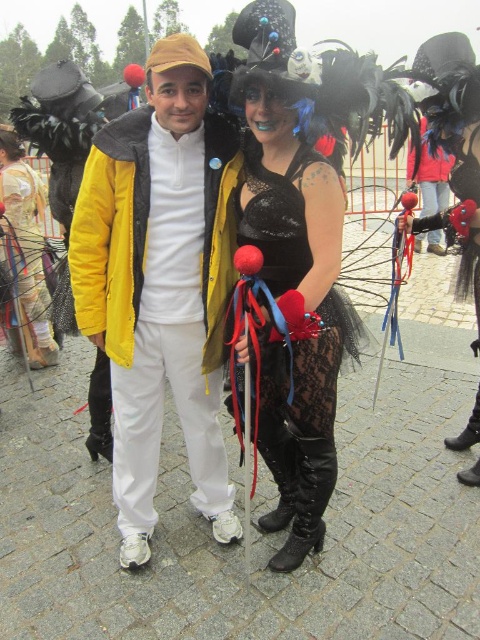
Looking at this image, can you confirm if lace fabric dress at center is smaller than matte gold dress at center?

Yes, lace fabric dress at center is smaller than matte gold dress at center.

Who is lower down, lace fabric dress at center or matte gold dress at center?

lace fabric dress at center is below.

This screenshot has height=640, width=480. Identify the location of lace fabric dress at center. (304, 308).

Can you confirm if matte yellow jacket at center is positioned to the left of matte gold dress at center?

In fact, matte yellow jacket at center is to the right of matte gold dress at center.

Does matte yellow jacket at center appear on the right side of matte gold dress at center?

Correct, you'll find matte yellow jacket at center to the right of matte gold dress at center.

Identify the location of matte yellow jacket at center. (160, 284).

Can you confirm if matte yellow jacket at center is positioned to the right of lace fabric dress at center?

Incorrect, matte yellow jacket at center is not on the right side of lace fabric dress at center.

Is point (228, 490) closer to camera compared to point (285, 285)?

No, (228, 490) is behind (285, 285).

At what (x,y) coordinates should I click in order to perform the action: click on matte yellow jacket at center. Please return your answer as a coordinate pair (x, y). Image resolution: width=480 pixels, height=640 pixels. Looking at the image, I should click on (160, 284).